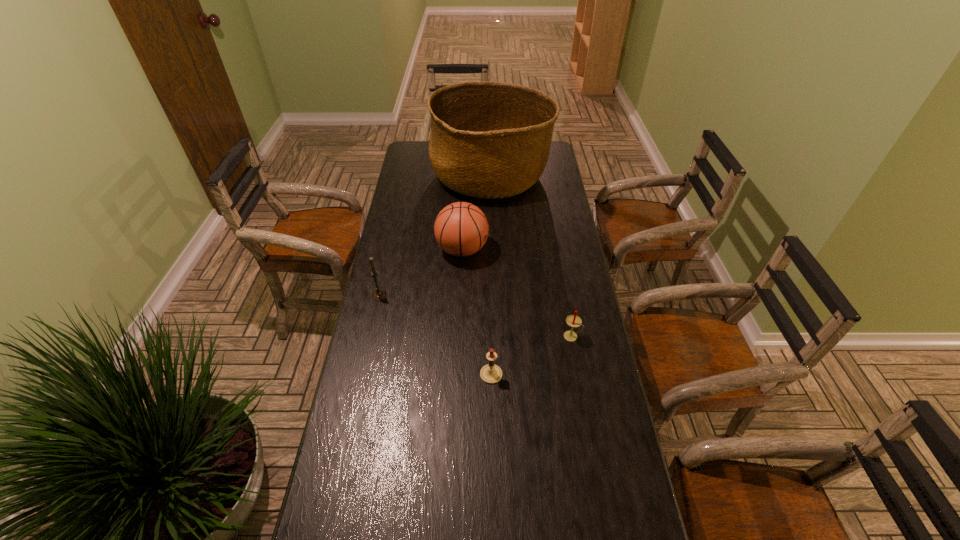
I want to click on the tallest object, so click(489, 140).

This screenshot has height=540, width=960. I want to click on the farthest object, so click(x=489, y=140).

This screenshot has width=960, height=540. I want to click on basketball, so 461,229.

Where is `the leftmost object`? the leftmost object is located at coordinates (379, 294).

Identify the location of the leftmost candle. Image resolution: width=960 pixels, height=540 pixels. (379, 294).

The width and height of the screenshot is (960, 540). Identify the location of the second nearest candle. (573, 321).

Identify the location of the second nearest object. (573, 321).

Where is `the nearest candle`? Image resolution: width=960 pixels, height=540 pixels. the nearest candle is located at coordinates (491, 373).

Locate an element on the screen. the second candle from right to left is located at coordinates (491, 373).

This screenshot has width=960, height=540. Identify the location of vacant space located on the front of the farthest object. (492, 258).